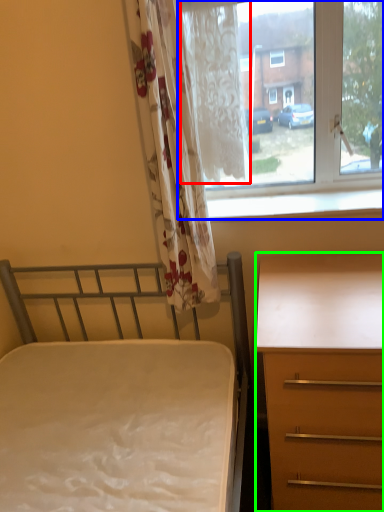
Question: Estimate the real-world distances between objects in this image. Which object is farther from curtain (highlighted by a red box), window (highlighted by a blue box) or desk (highlighted by a green box)?

Choices:
 (A) window
 (B) desk

Answer: (B)